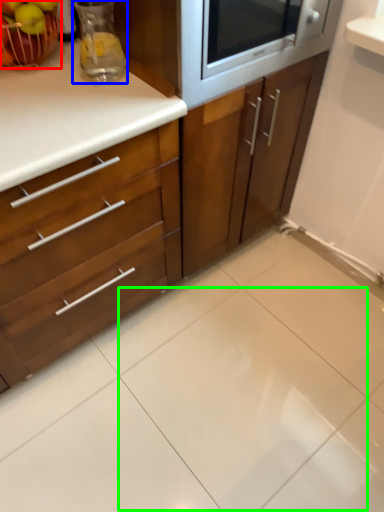
Question: Which object is the farthest from apple (highlighted by a red box)? Choose among these: appliance (highlighted by a blue box) or ceramic tile (highlighted by a green box).

Choices:
 (A) appliance
 (B) ceramic tile

Answer: (B)